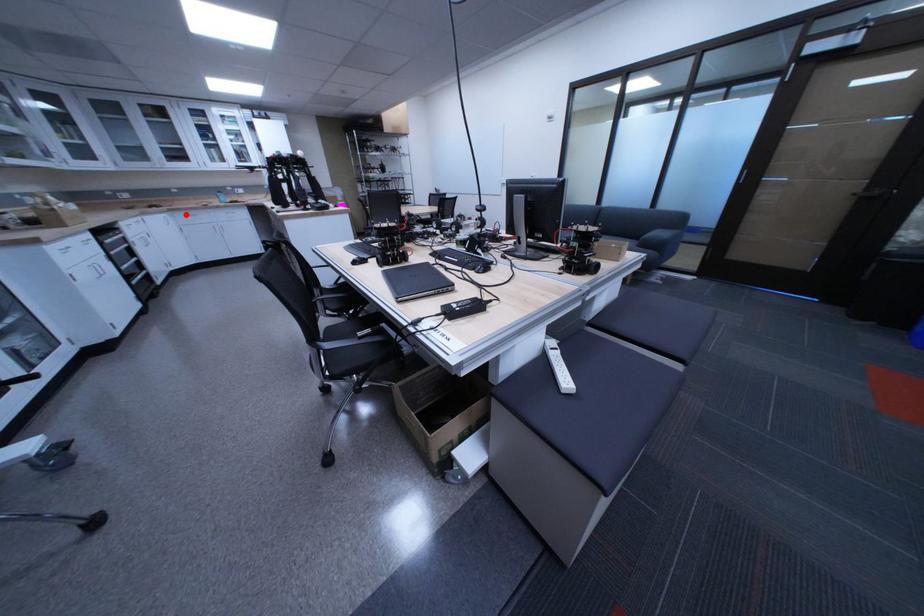
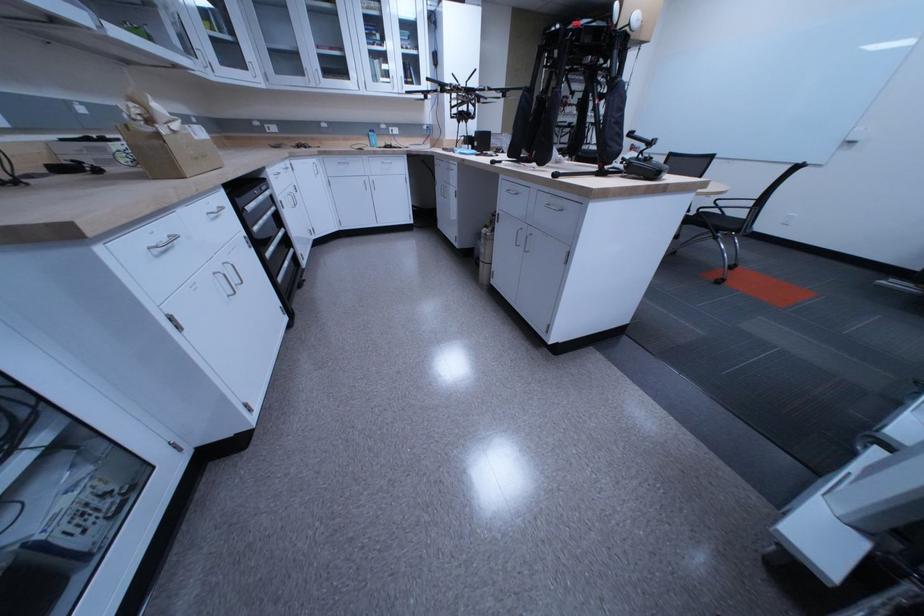
Question: I am providing you with two images of the same scene from different viewpoints. In image1, a red point is highlighted. Considering the same 3D point in image2, which of the following is correct?

Choices:
 (A) It is closer
 (B) It is farther

Answer: (A)